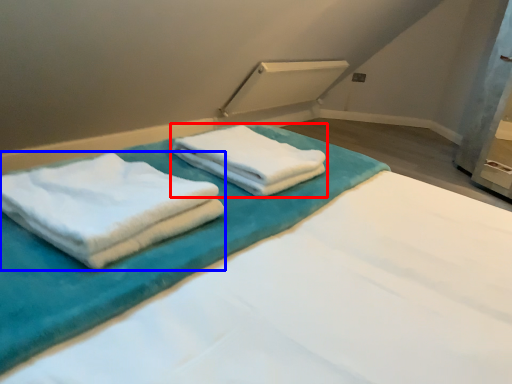
Question: Among these objects, which one is nearest to the camera, towel (highlighted by a red box) or towel (highlighted by a blue box)?

Choices:
 (A) towel
 (B) towel

Answer: (B)